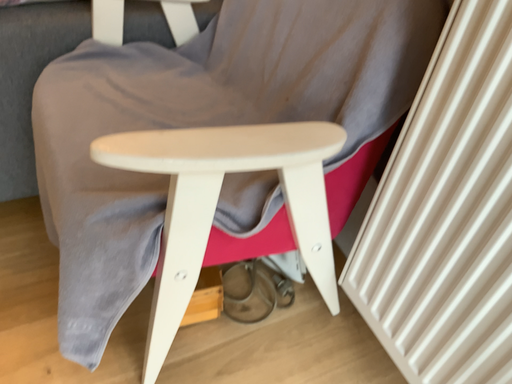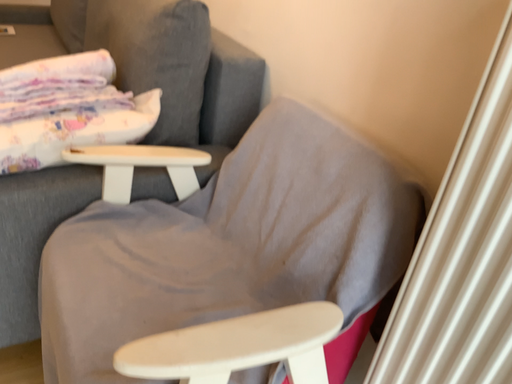
Question: Which way did the camera rotate in the video?

Choices:
 (A) rotated downward
 (B) rotated upward

Answer: (B)